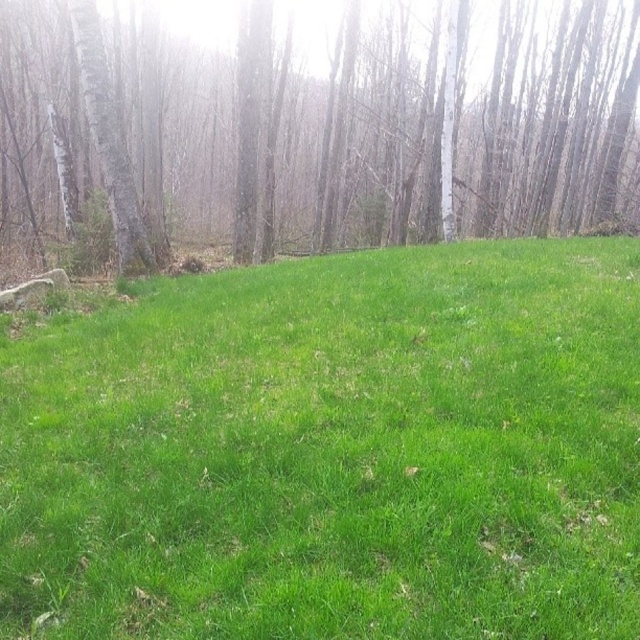
You are standing at the center of the forest scene and want to walk towards the dense cluster of trees in the background. Which direction should you move relative to the point labeled as point (332, 451)?

The point (332, 451) corresponds to the green grassy field at center. To reach the dense cluster of trees in the background, you should move towards the background direction from the point (332, 451) since the trees are located behind the grassy area.

You are a gardener planning to plant new flowers in the green grassy field at center and the smooth bark tree at left. Which area would you choose if you want to ensure the flowers have enough space to grow?

The smooth bark tree at left has thicker soil, so planting flowers there would provide more space for growth compared to the thinner green grassy field at center.

You are standing at the origin point in the image. Which direction should you move to reach the green grassy field at center?

The green grassy field at center is located at coordinates 0.706 on the x and 0.520 on the y, so you should move towards the right and slightly forward to reach it.